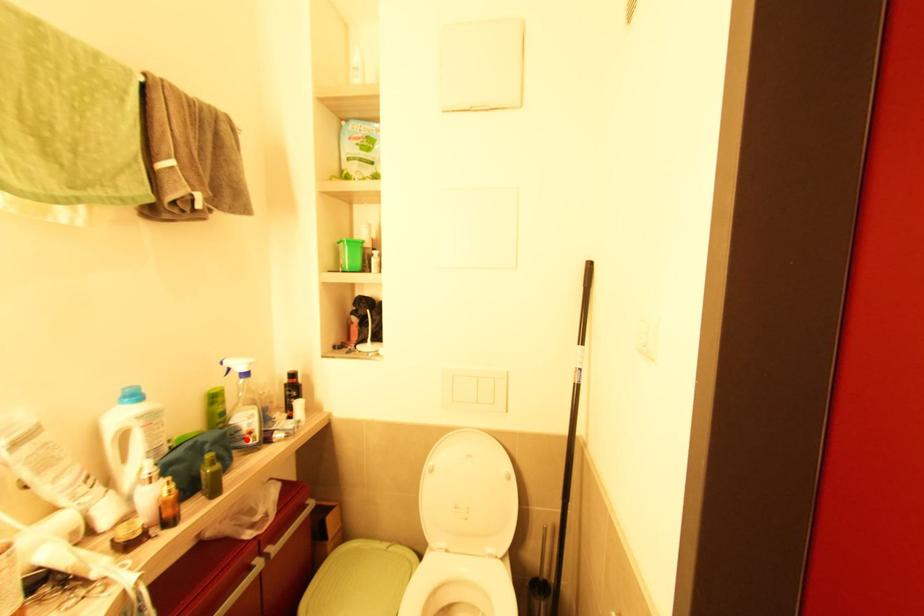
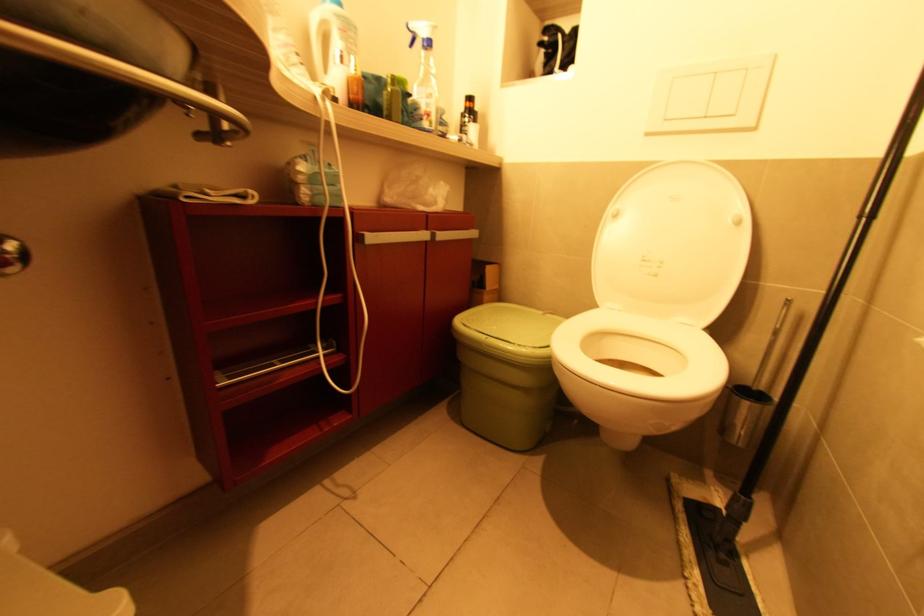
Find the pixel in the second image that matches the highlighted location in the first image.

(424, 121)